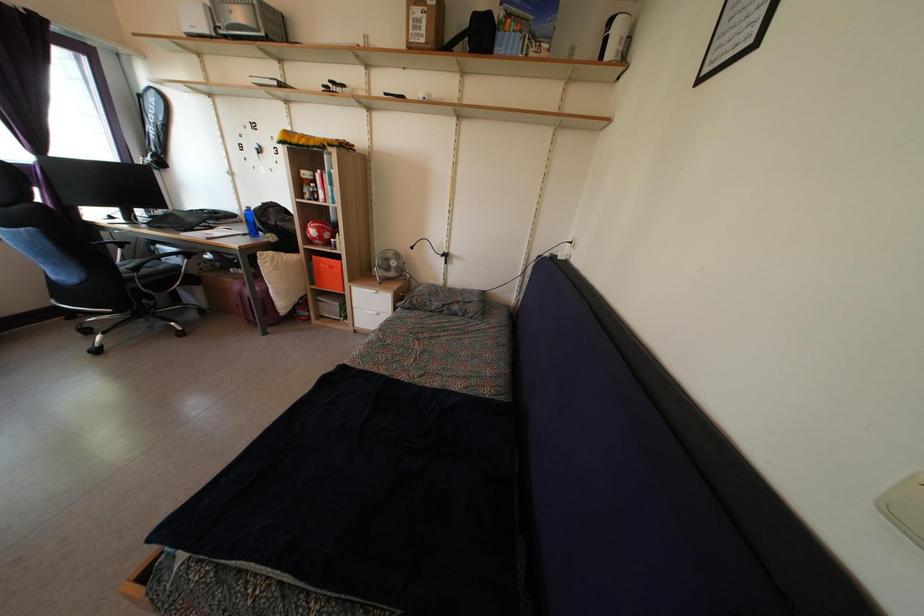
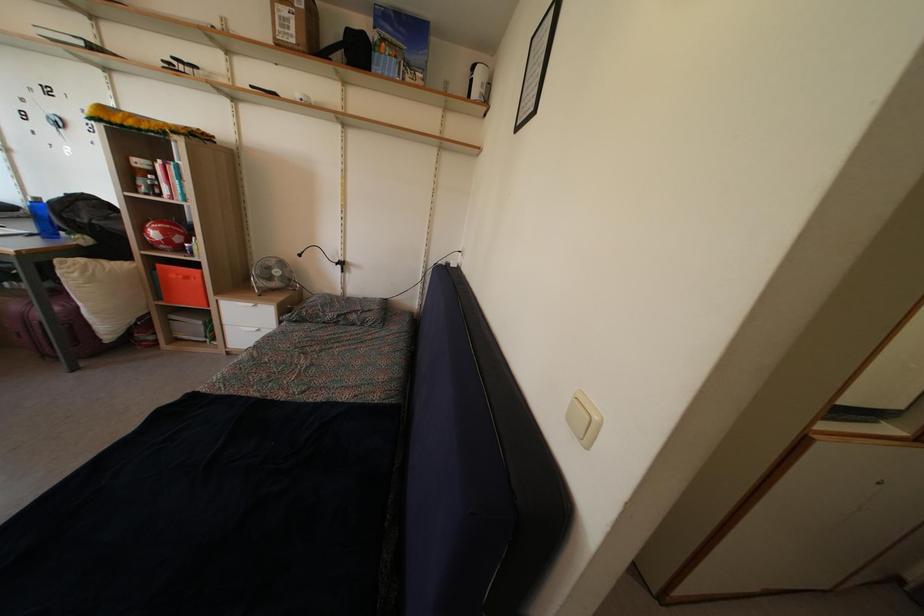
In the second image, find the point that corresponds to point 289,261 in the first image.

(116, 268)